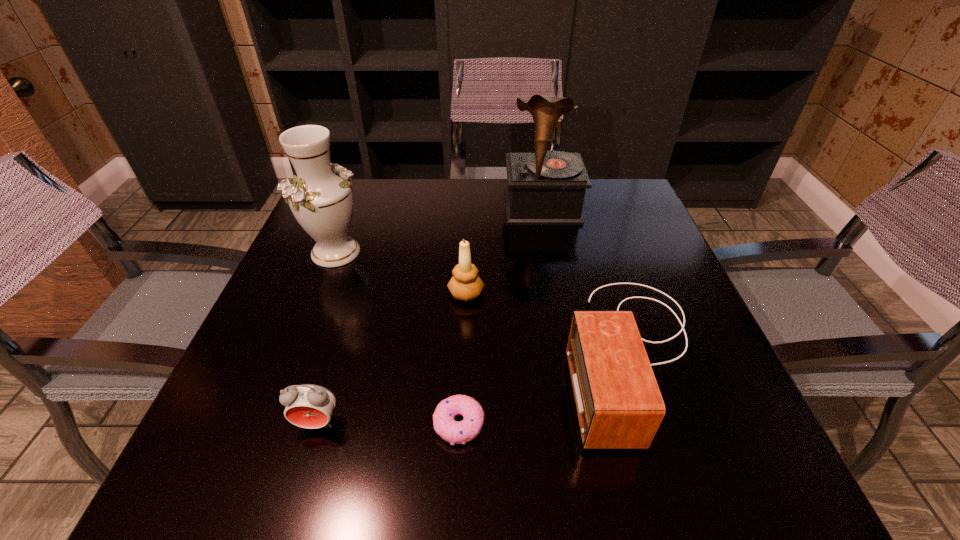
Identify the location of vacant region located 0.080m on the front-facing side of the radio receiver. (522, 354).

Where is `vacant position located 0.190m on the front-facing side of the radio receiver`? The height and width of the screenshot is (540, 960). vacant position located 0.190m on the front-facing side of the radio receiver is located at coordinates (465, 354).

Where is `blank space located on the left of the shortest object`? blank space located on the left of the shortest object is located at coordinates (283, 424).

I want to click on object at the far edge, so click(547, 187).

Locate an element on the screen. The height and width of the screenshot is (540, 960). radio receiver at the near edge is located at coordinates (618, 403).

At what (x,y) coordinates should I click in order to perform the action: click on doughnut located at the near edge. Please return your answer as a coordinate pair (x, y). This screenshot has height=540, width=960. Looking at the image, I should click on (456, 432).

What are the coordinates of `vase that is at the left edge` in the screenshot? It's located at (322, 201).

This screenshot has height=540, width=960. Identify the location of alarm clock that is at the left edge. (310, 406).

Where is `object located in the right edge section of the desktop`? This screenshot has width=960, height=540. object located in the right edge section of the desktop is located at coordinates (618, 403).

This screenshot has width=960, height=540. I want to click on object that is at the near right corner, so click(x=618, y=403).